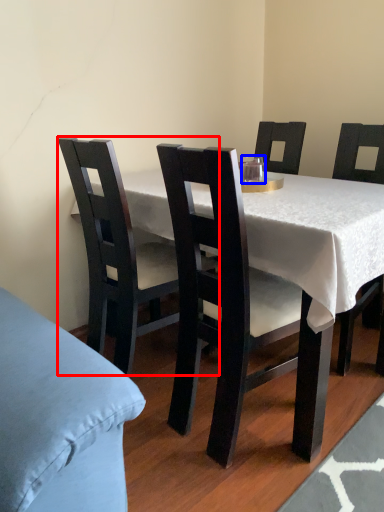
Question: Which point is further to the camera, chair (highlighted by a red box) or coffee cup (highlighted by a blue box)?

Choices:
 (A) chair
 (B) coffee cup

Answer: (B)